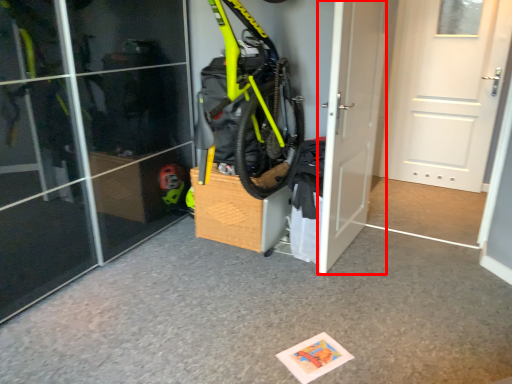
Question: From the image, what is the correct spatial relationship of door (annotated by the red box) in relation to door?

Choices:
 (A) left
 (B) right

Answer: (A)